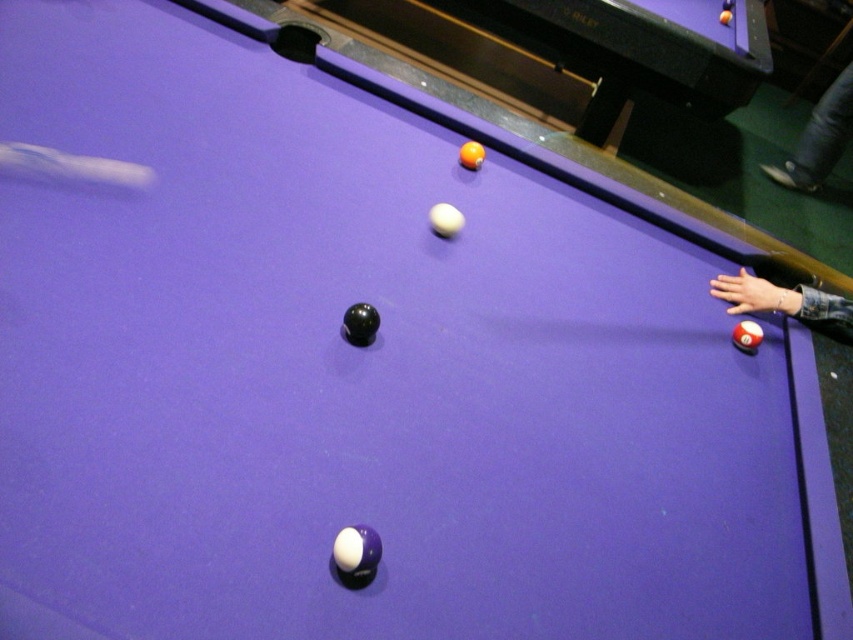
Image resolution: width=853 pixels, height=640 pixels. What do you see at coordinates (578, 51) in the screenshot? I see `orange glossy ball at upper center` at bounding box center [578, 51].

Can you confirm if orange glossy ball at upper center is taller than denim pants at right?

Indeed, orange glossy ball at upper center has a greater height compared to denim pants at right.

Is point (589, 106) behind point (788, 161)?

No.

Image resolution: width=853 pixels, height=640 pixels. Find the location of `orange glossy ball at upper center`. orange glossy ball at upper center is located at coordinates (578, 51).

Can you confirm if denim pants at right is smaller than smooth leather hand at right?

Incorrect, denim pants at right is not smaller in size than smooth leather hand at right.

Is denim pants at right wider than smooth leather hand at right?

Yes.

You are a GUI agent. You are given a task and a screenshot of the screen. Output one action in this format:
    pyautogui.click(x=<x>, y=<y>)
    Task: Click on the denim pants at right
    
    Given the screenshot: What is the action you would take?
    pyautogui.click(x=819, y=138)

Who is more forward, (595, 97) or (811, 294)?

Point (811, 294)

Is orange glossy ball at upper center bigger than smooth leather hand at right?

Yes.

Between point (547, 44) and point (752, 301), which one is positioned in front?

Point (752, 301)

The width and height of the screenshot is (853, 640). What are the coordinates of `orange glossy ball at upper center` in the screenshot? It's located at (578, 51).